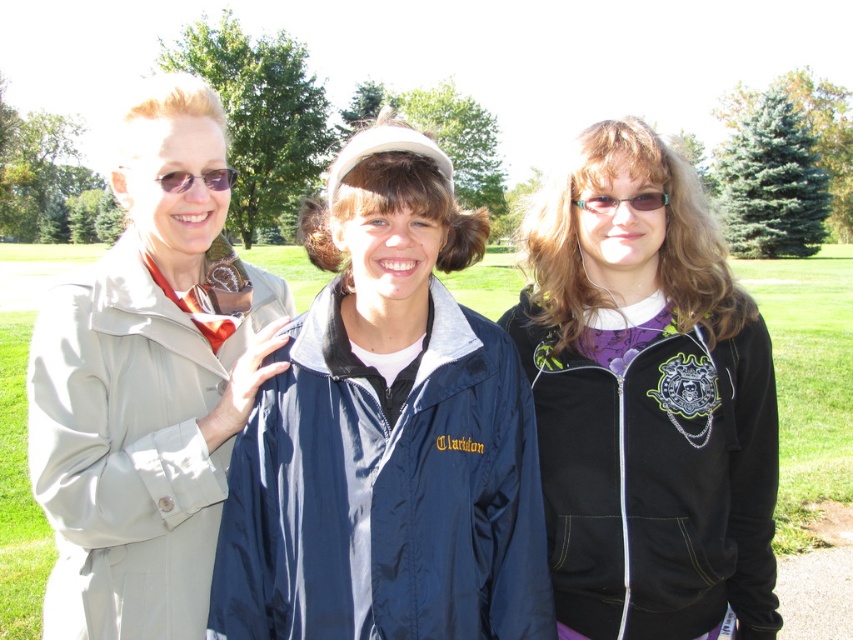
Who is positioned more to the right, matte beige trench coat at left or matte plastic glasses at center?

From the viewer's perspective, matte plastic glasses at center appears more on the right side.

Does matte beige trench coat at left have a lesser width compared to matte plastic glasses at center?

In fact, matte beige trench coat at left might be wider than matte plastic glasses at center.

Consider the image. Who is more distant from viewer, (128, 134) or (619, 200)?

Positioned behind is point (619, 200).

Identify the location of matte beige trench coat at left. 148,384.

Can you confirm if matte plastic glasses at center is positioned below matte black sunglasses at upper left?

Correct, matte plastic glasses at center is located below matte black sunglasses at upper left.

Is matte plastic glasses at center behind matte black sunglasses at upper left?

That is True.

The image size is (853, 640). In order to click on matte plastic glasses at center in this screenshot , I will do `click(624, 202)`.

You are a GUI agent. You are given a task and a screenshot of the screen. Output one action in this format:
    pyautogui.click(x=<x>, y=<y>)
    Task: Click on the matte beige trench coat at left
    The width and height of the screenshot is (853, 640).
    Given the screenshot: What is the action you would take?
    pyautogui.click(x=148, y=384)

Is point (224, 256) more distant than point (206, 176)?

That is True.

At what (x,y) coordinates should I click in order to perform the action: click on matte beige trench coat at left. Please return your answer as a coordinate pair (x, y). Looking at the image, I should click on (148, 384).